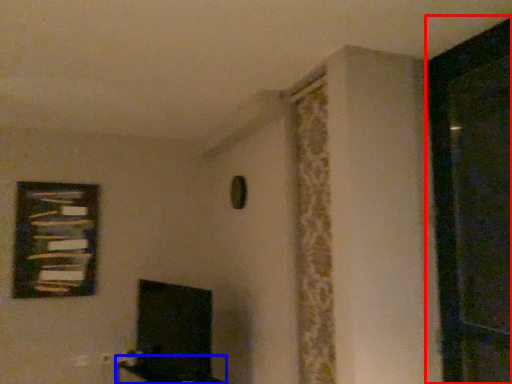
Question: Which of the following is the closest to the observer, screen door (highlighted by a red box) or furniture (highlighted by a blue box)?

Choices:
 (A) screen door
 (B) furniture

Answer: (A)